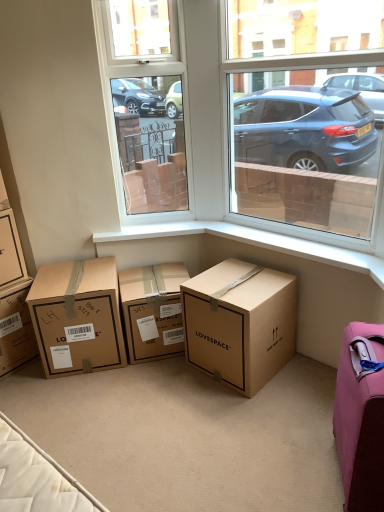
Question: Can you confirm if brown cardboard box at lower left, the 1th box positioned from the left, is shorter than brown cardboard box at left, which ranks as the second box in left-to-right order?

Choices:
 (A) yes
 (B) no

Answer: (B)

Question: From a real-world perspective, is brown cardboard box at lower left, which is counted as the 5th box, starting from the right, on top of brown cardboard box at left, arranged as the 4th box when viewed from the right?

Choices:
 (A) yes
 (B) no

Answer: (B)

Question: Does brown cardboard box at lower left, which is counted as the 5th box, starting from the right, have a larger size compared to brown cardboard box at left, arranged as the 4th box when viewed from the right?

Choices:
 (A) yes
 (B) no

Answer: (A)

Question: Is brown cardboard box at lower left, the 1th box positioned from the left, looking in the opposite direction of brown cardboard box at left, arranged as the 4th box when viewed from the right?

Choices:
 (A) no
 (B) yes

Answer: (A)

Question: Can you confirm if brown cardboard box at lower left, which is counted as the 5th box, starting from the right, is positioned to the right of brown cardboard box at left, which ranks as the second box in left-to-right order?

Choices:
 (A) yes
 (B) no

Answer: (B)

Question: Is brown cardboard box at lower left, the 1th box positioned from the left, at the left side of brown cardboard box at left, arranged as the 4th box when viewed from the right?

Choices:
 (A) no
 (B) yes

Answer: (B)

Question: Does brown cardboard box at center, the second box from the right, come in front of brown cardboard box at lower left, which is counted as the 5th box, starting from the right?

Choices:
 (A) no
 (B) yes

Answer: (A)

Question: Is brown cardboard box at center, the second box from the right, not within brown cardboard box at lower left, which is counted as the 5th box, starting from the right?

Choices:
 (A) no
 (B) yes

Answer: (B)

Question: Is brown cardboard box at lower left, which is counted as the 5th box, starting from the right, at the back of brown cardboard box at center, the second box from the right?

Choices:
 (A) no
 (B) yes

Answer: (A)

Question: Does brown cardboard box at center, the second box from the right, turn towards brown cardboard box at lower left, which is counted as the 5th box, starting from the right?

Choices:
 (A) yes
 (B) no

Answer: (B)

Question: From the image's perspective, would you say brown cardboard box at center, arranged as the 4th box when viewed from the left, is shown under brown cardboard box at lower left, which is counted as the 5th box, starting from the right?

Choices:
 (A) no
 (B) yes

Answer: (A)

Question: From a real-world perspective, is brown cardboard box at center, the second box from the right, on top of brown cardboard box at lower left, the 1th box positioned from the left?

Choices:
 (A) yes
 (B) no

Answer: (B)

Question: Does brown cardboard box at lower left, the 1th box positioned from the left, have a greater height compared to pink fabric suitcase at lower right?

Choices:
 (A) no
 (B) yes

Answer: (A)